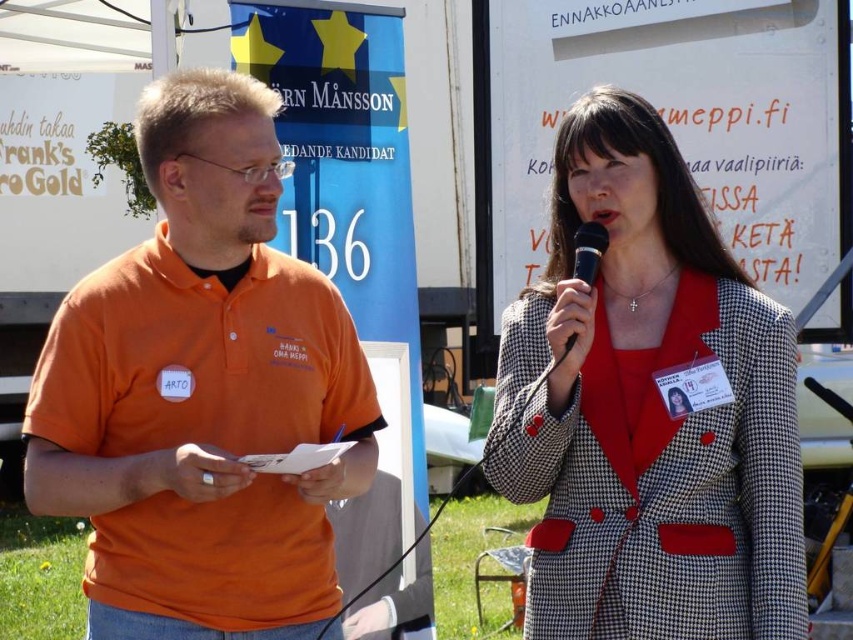
Can you confirm if orange cotton polo shirt at left is taller than houndstooth fabric blazer at center?

In fact, orange cotton polo shirt at left may be shorter than houndstooth fabric blazer at center.

Can you confirm if orange cotton polo shirt at left is positioned to the right of houndstooth fabric blazer at center?

In fact, orange cotton polo shirt at left is to the left of houndstooth fabric blazer at center.

Describe the element at coordinates (202, 392) in the screenshot. I see `orange cotton polo shirt at left` at that location.

I want to click on orange cotton polo shirt at left, so click(x=202, y=392).

Can you confirm if orange cotton polo shirt at left is wider than black plastic microphone at upper center?

Indeed, orange cotton polo shirt at left has a greater width compared to black plastic microphone at upper center.

You are a GUI agent. You are given a task and a screenshot of the screen. Output one action in this format:
    pyautogui.click(x=<x>, y=<y>)
    Task: Click on the orange cotton polo shirt at left
    
    Given the screenshot: What is the action you would take?
    pyautogui.click(x=202, y=392)

Find the location of a particular element. orange cotton polo shirt at left is located at coordinates (202, 392).

You are a GUI agent. You are given a task and a screenshot of the screen. Output one action in this format:
    pyautogui.click(x=<x>, y=<y>)
    Task: Click on the orange cotton polo shirt at left
    Image resolution: width=853 pixels, height=640 pixels.
    Given the screenshot: What is the action you would take?
    pyautogui.click(x=202, y=392)

Which is behind, point (567, 529) or point (595, 244)?

The point (567, 529) is more distant.

Which is in front, point (798, 611) or point (584, 252)?

Point (798, 611) is more forward.

What do you see at coordinates (648, 408) in the screenshot? The width and height of the screenshot is (853, 640). I see `houndstooth fabric blazer at center` at bounding box center [648, 408].

Find the location of a particular element. This screenshot has height=640, width=853. houndstooth fabric blazer at center is located at coordinates (648, 408).